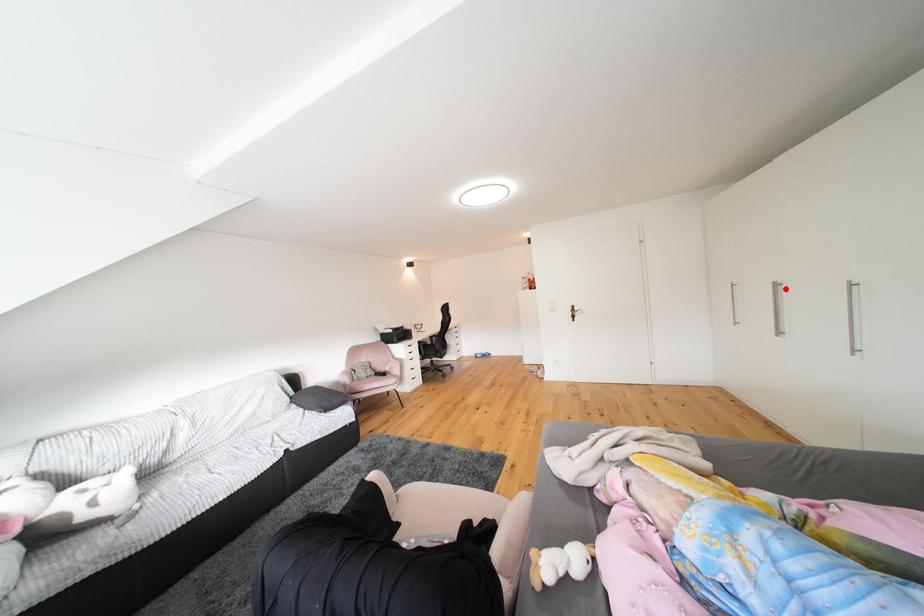
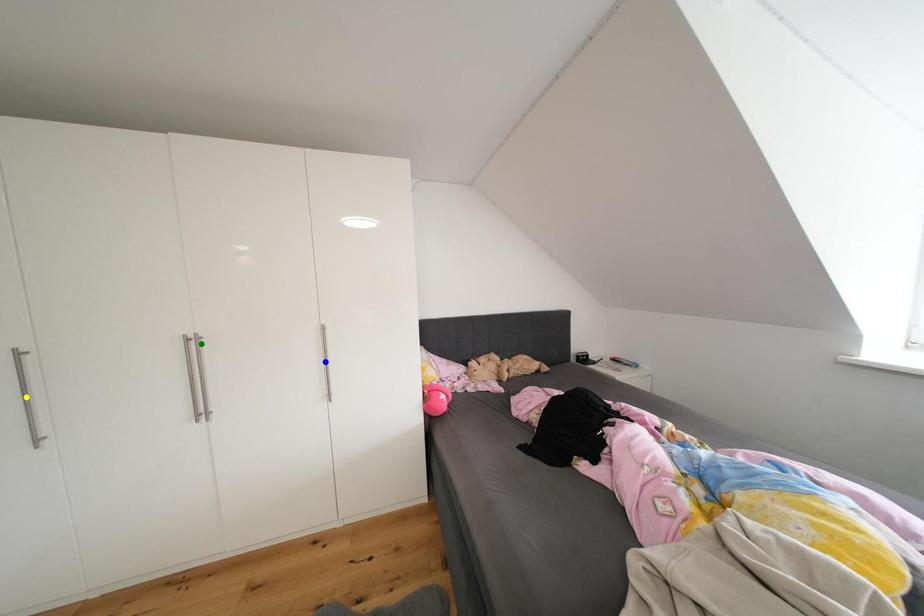
Question: I am providing you with two images of the same scene from different viewpoints. A red point is marked on the first image. You are given multiple points on the second image. Which point in image 2 is actually the same real-world point as the red point in image 1?

Choices:
 (A) yellow point
 (B) blue point
 (C) green point

Answer: (C)